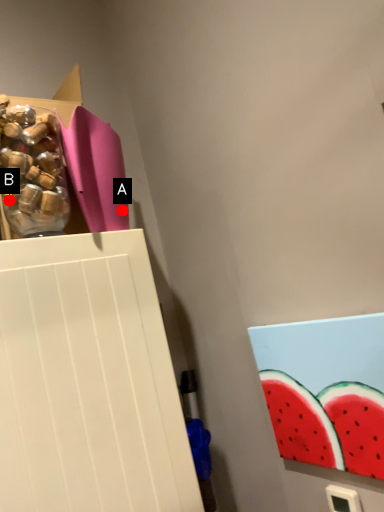
Question: Two points are circled on the image, labeled by A and B beside each circle. Which point is farther to the camera?

Choices:
 (A) A is further
 (B) B is further

Answer: (A)